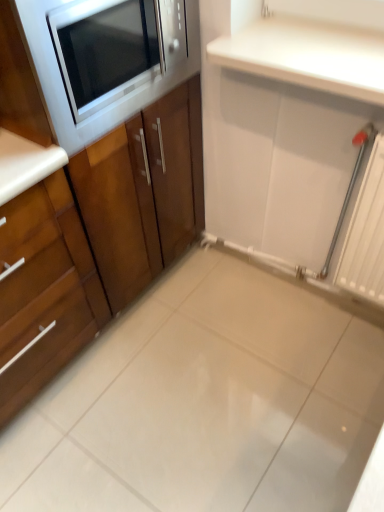
The height and width of the screenshot is (512, 384). I want to click on free point above white glossy ceramic tile at center (from a real-world perspective), so click(x=214, y=391).